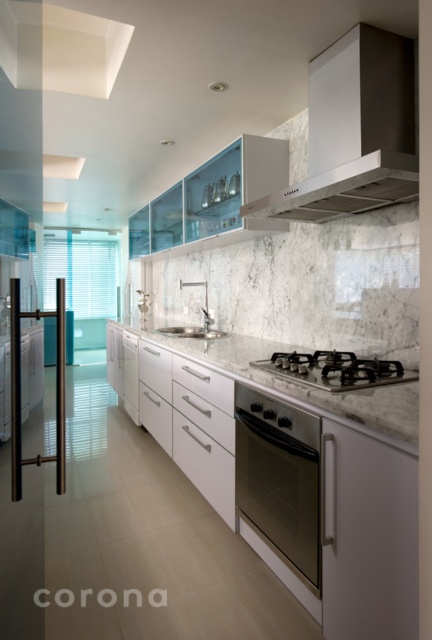
You are a kitchen designer trying to install a new appliance. You have a white glossy dishwasher at center and a white marble sink at center. Which one has a smaller width?

The white glossy dishwasher at center is thinner than the white marble sink at center, so the dishwasher has a smaller width.

You are standing in the kitchen and want to reach both the point at coordinates (368, 72) and the point at coordinates (133, 385). Which point will you reach first?

You will reach point (368, 72) first because it is closer to you than point (133, 385).